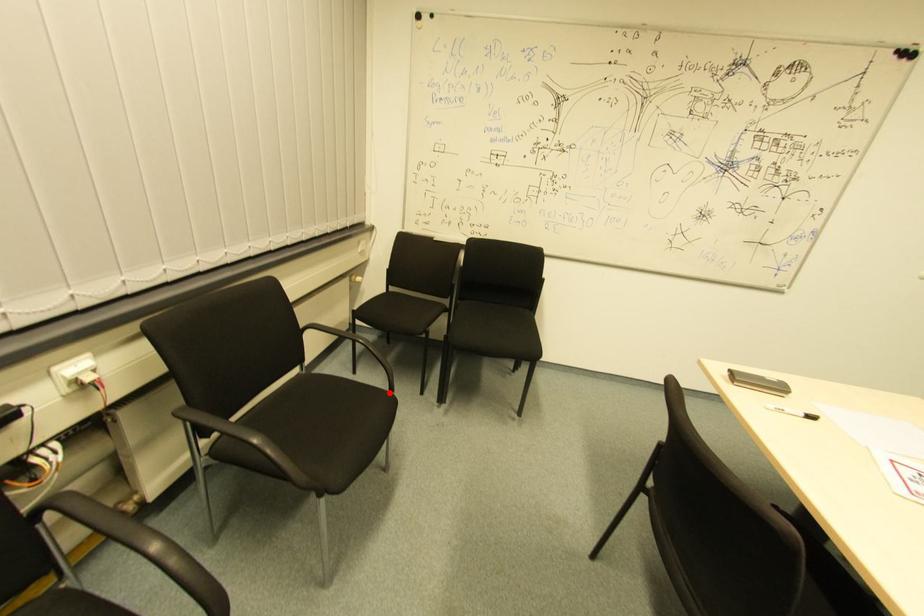
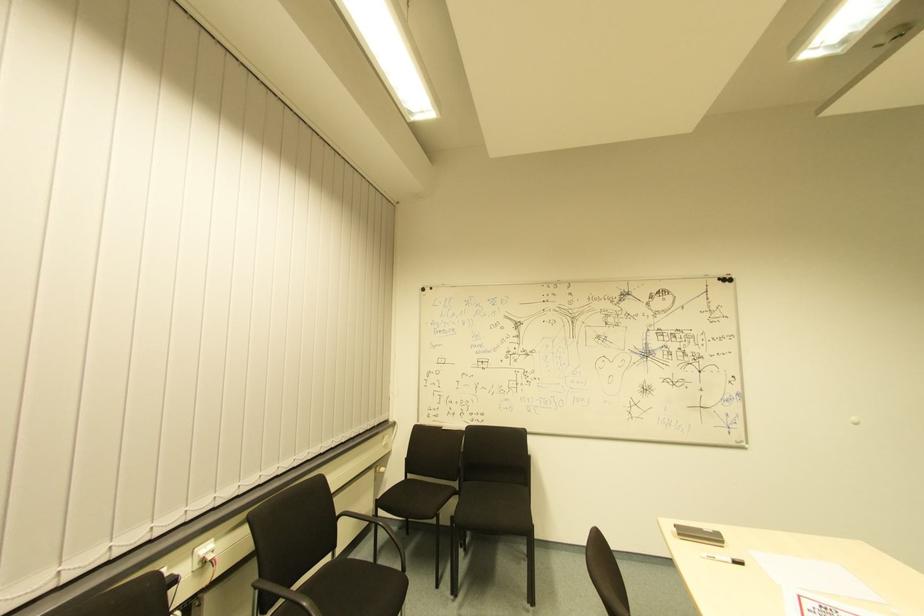
Locate, in the second image, the point that corresponds to the highlighted location in the first image.

(402, 573)